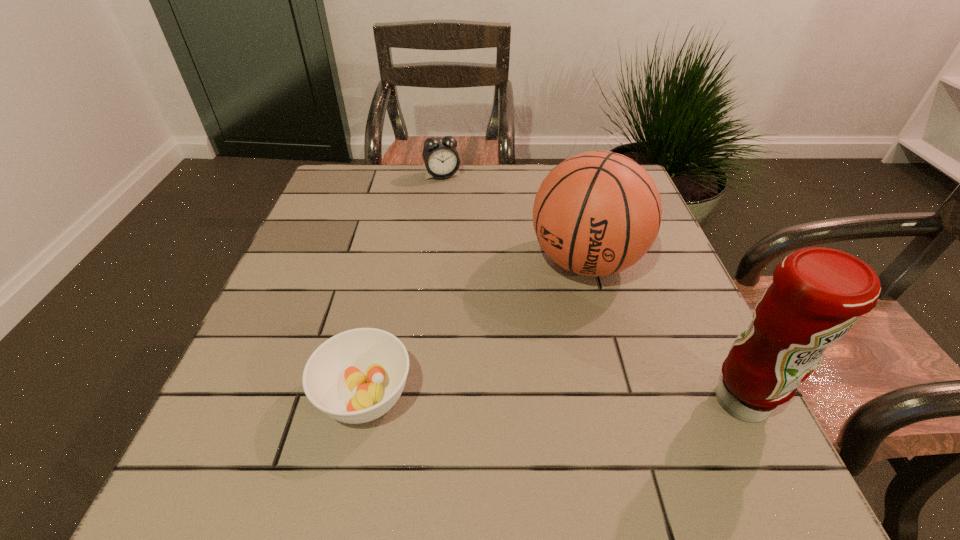
Where is `vacant space positioned 0.100m on the surface of the basketball near the brand logo`? vacant space positioned 0.100m on the surface of the basketball near the brand logo is located at coordinates pos(544,327).

You are a GUI agent. You are given a task and a screenshot of the screen. Output one action in this format:
    pyautogui.click(x=<x>, y=<y>)
    Task: Click on the vacant area situated 0.310m on the front side of the second shortest object
    
    Given the screenshot: What is the action you would take?
    pyautogui.click(x=474, y=247)

You are a GUI agent. You are given a task and a screenshot of the screen. Output one action in this format:
    pyautogui.click(x=<x>, y=<y>)
    Task: Click on the vacant space positioned 0.190m on the front side of the second shortest object
    The image size is (960, 540).
    Given the screenshot: What is the action you would take?
    pyautogui.click(x=463, y=219)

This screenshot has width=960, height=540. I want to click on vacant region located 0.050m on the front side of the second shortest object, so click(450, 191).

You are a GUI agent. You are given a task and a screenshot of the screen. Output one action in this format:
    pyautogui.click(x=<x>, y=<y>)
    Task: Click on the object situated at the far edge
    This screenshot has width=960, height=540.
    Given the screenshot: What is the action you would take?
    pyautogui.click(x=440, y=156)

Locate an element on the screen. This screenshot has width=960, height=540. soup bowl that is at the near edge is located at coordinates (356, 376).

Find the location of a particular element. condiment at the near edge is located at coordinates (817, 294).

Image resolution: width=960 pixels, height=540 pixels. Identify the location of object that is positioned at the left edge. (356, 376).

The height and width of the screenshot is (540, 960). I want to click on condiment that is at the right edge, so click(817, 294).

I want to click on basketball that is at the right edge, so click(597, 213).